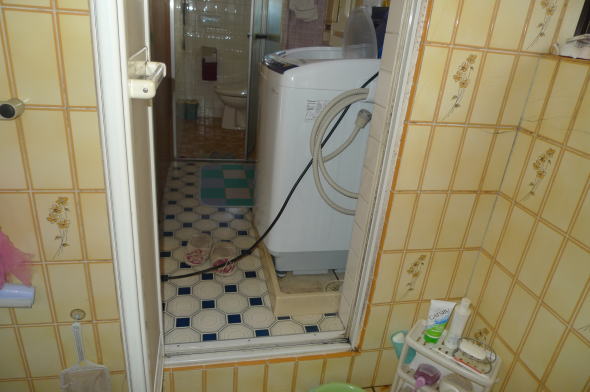
Locate an element on the screen. The height and width of the screenshot is (392, 590). mold is located at coordinates click(x=340, y=339).